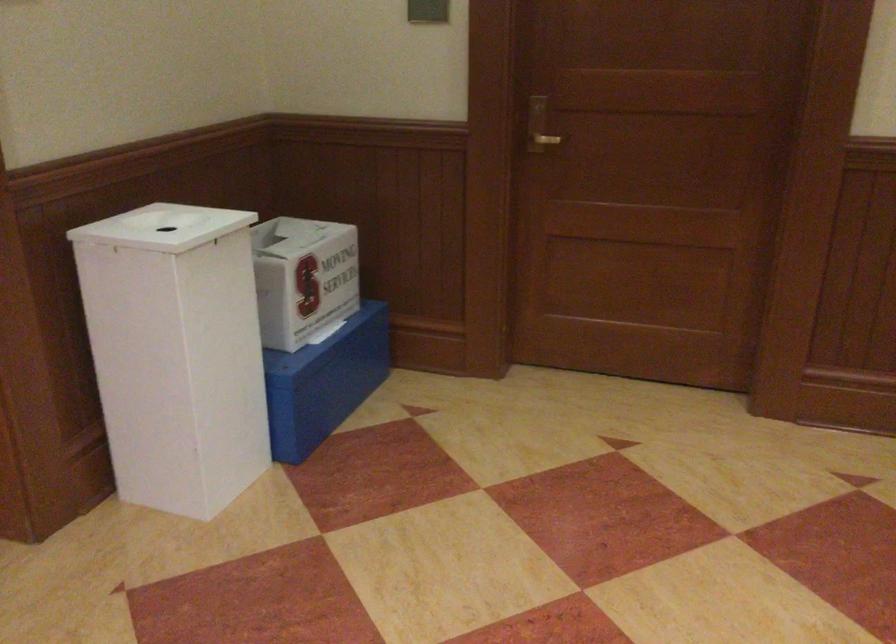
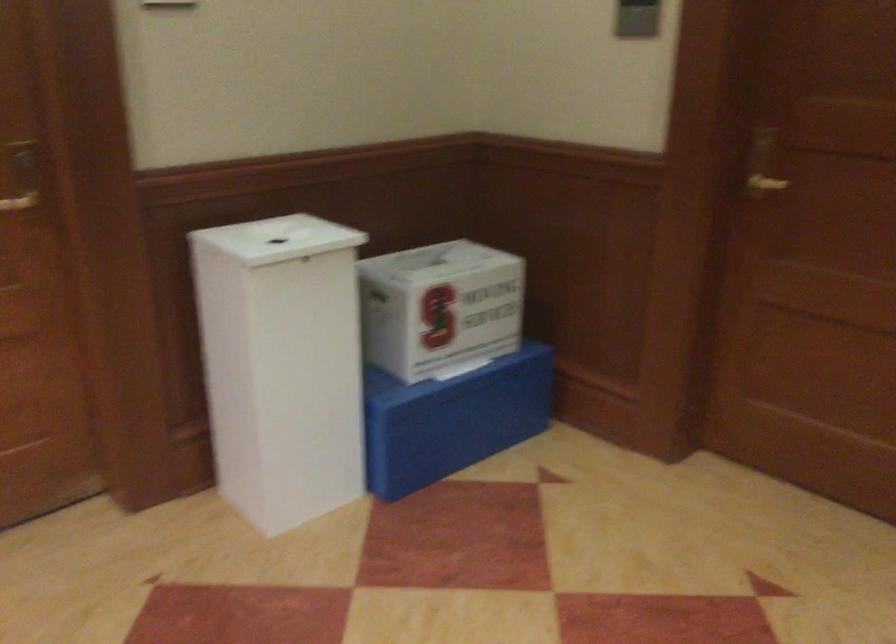
In the second image, find the point that corresponds to point 156,225 in the first image.

(277, 238)